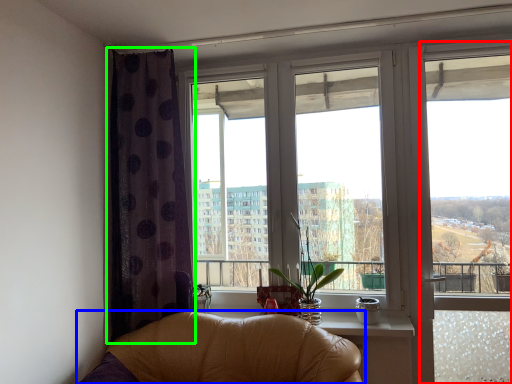
Question: Estimate the real-world distances between objects in this image. Which object is closer to window frame (highlighted by a red box), chair (highlighted by a blue box) or curtain (highlighted by a green box)?

Choices:
 (A) chair
 (B) curtain

Answer: (A)